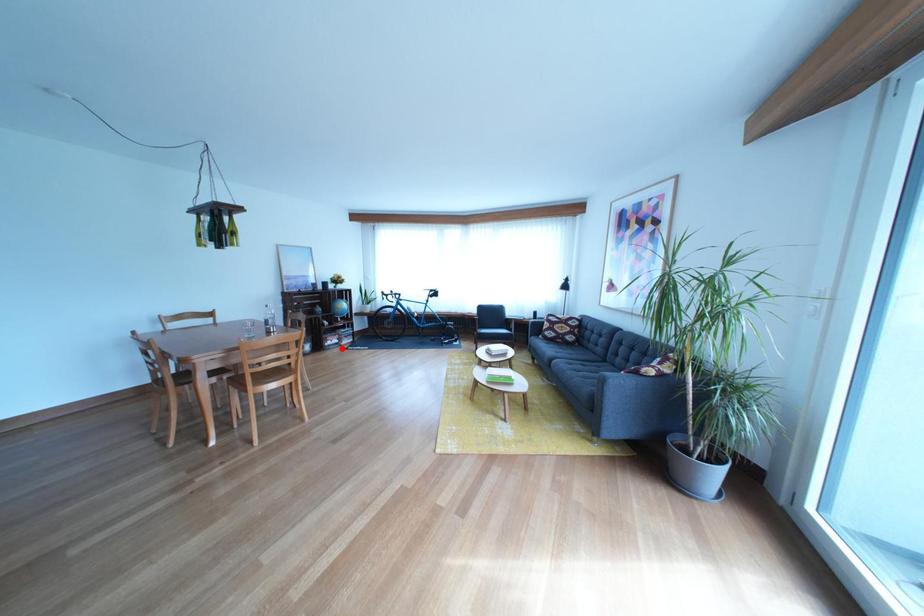
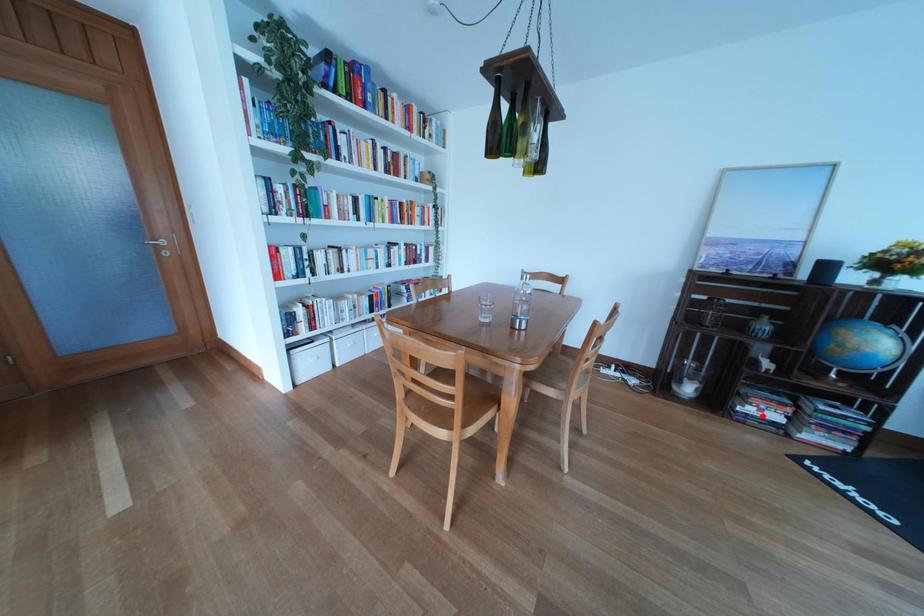
I am providing you with two images of the same scene from different viewpoints. A red point is marked on the first image and another point is marked on the second image. Are the points marked in image1 and image2 representing the same 3D position?

Yes